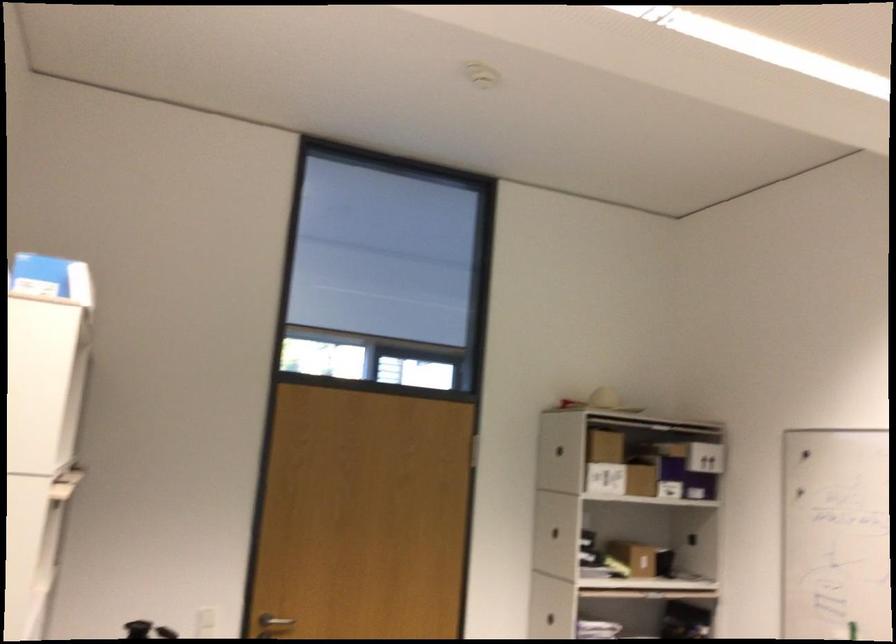
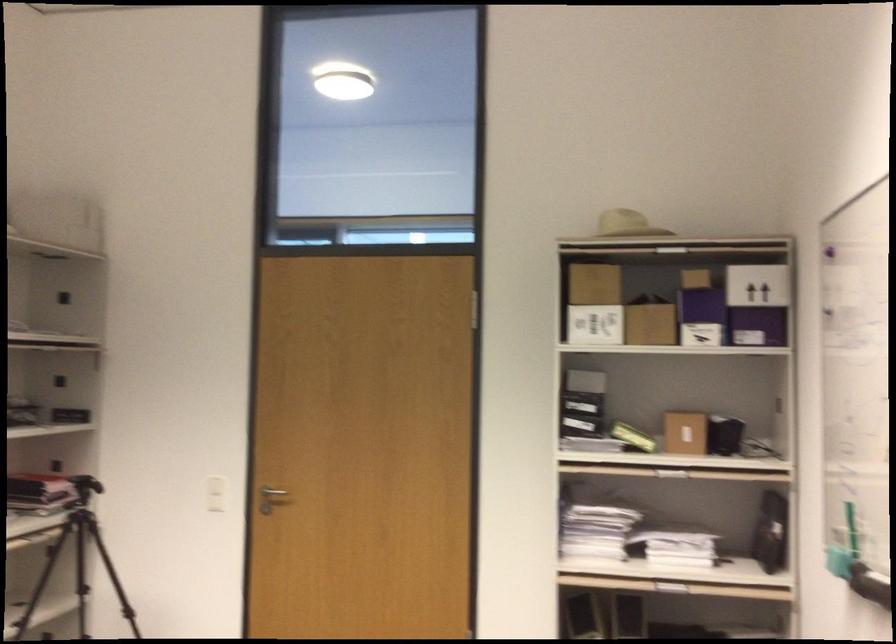
Locate, in the second image, the point that corresponds to point 591,478 in the first image.

(595, 325)